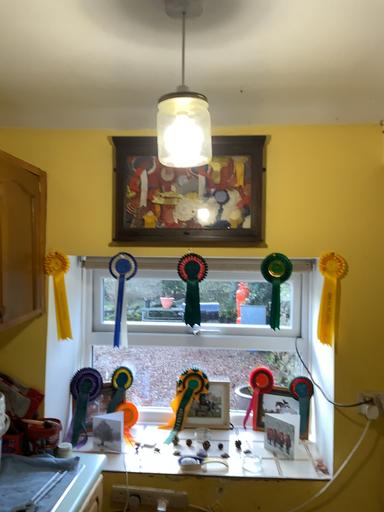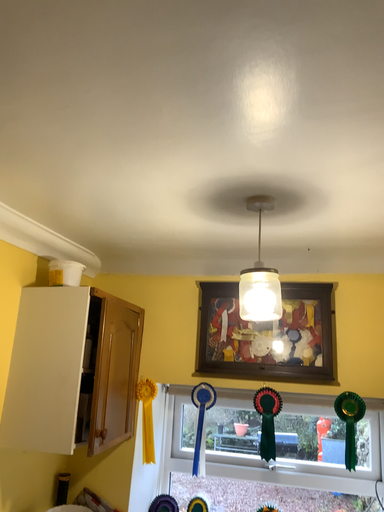
Question: How did the camera likely rotate when shooting the video?

Choices:
 (A) rotated downward
 (B) rotated upward

Answer: (B)